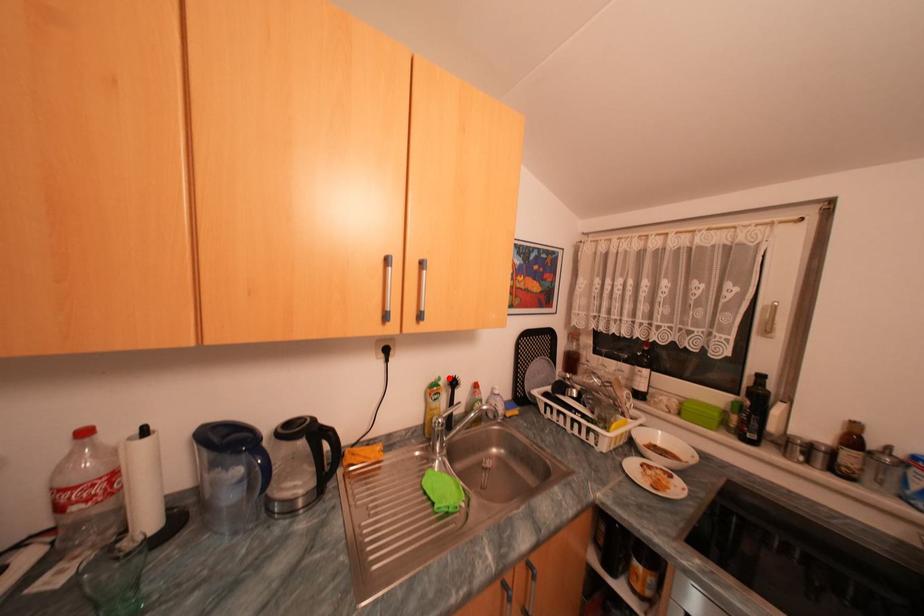
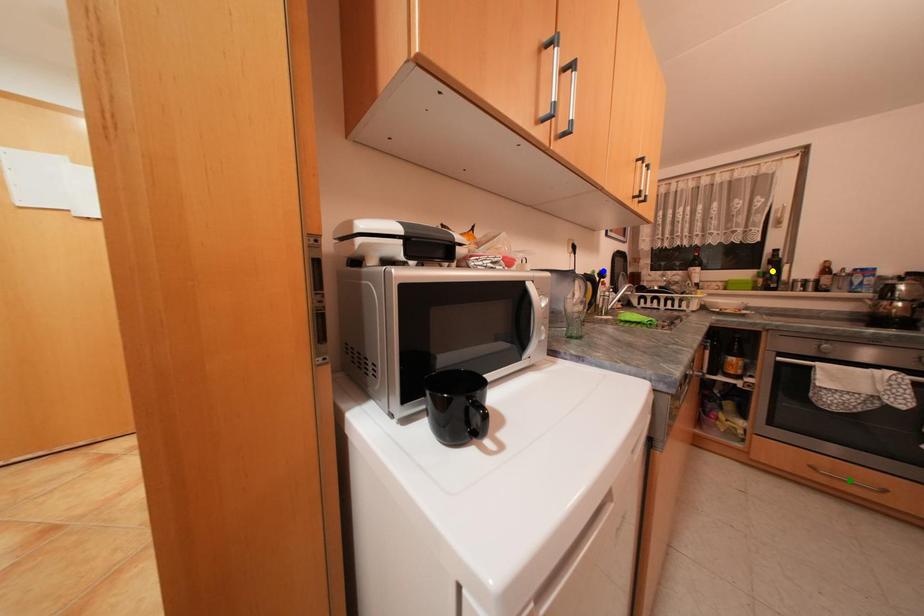
Question: I am providing you with two images of the same scene from different viewpoints. A red point is marked on the first image. You are given multiple points on the second image. Which point in image 2 represents the same 3d spot as the red point in image 1?

Choices:
 (A) green point
 (B) blue point
 (C) yellow point

Answer: (B)